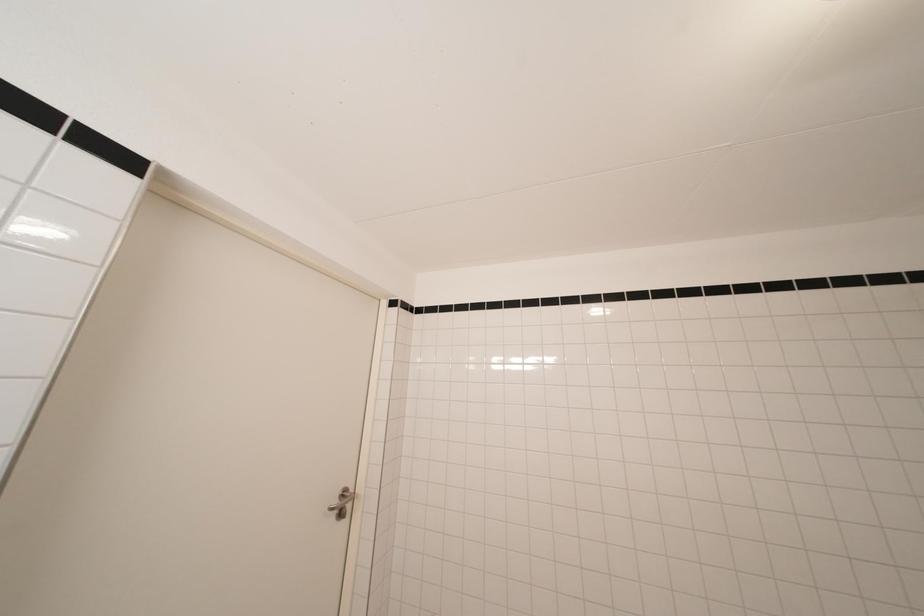
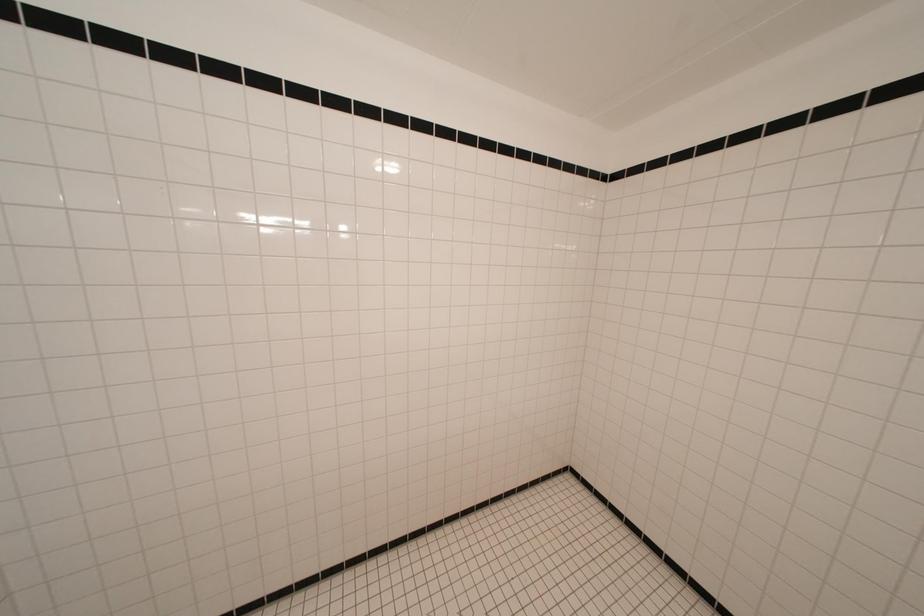
First-person continuous shooting, in which direction is the camera rotating?

The rotation direction of the camera is right-down.